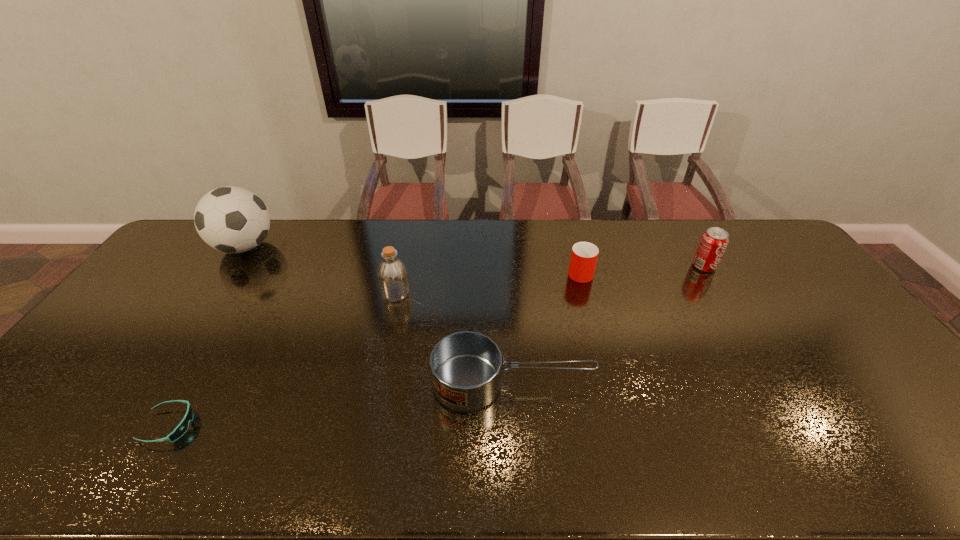
Image resolution: width=960 pixels, height=540 pixels. I want to click on vacant space located on the right of the rightmost object, so click(796, 266).

At what (x,y) coordinates should I click in order to perform the action: click on vacant region located 0.130m on the side of the fifth object from left to right with the handle. Please return your answer as a coordinate pair (x, y). Looking at the image, I should click on (571, 239).

Where is `free region located on the side of the fifth object from left to right with the handle`? The image size is (960, 540). free region located on the side of the fifth object from left to right with the handle is located at coordinates (567, 225).

What are the coordinates of `free space located 0.070m on the side of the fifth object from left to right with the handle` in the screenshot? It's located at (574, 248).

Where is `vacant area situated 0.330m with the handle extending from one side of the fourth object from left to right`? vacant area situated 0.330m with the handle extending from one side of the fourth object from left to right is located at coordinates (721, 383).

You are a GUI agent. You are given a task and a screenshot of the screen. Output one action in this format:
    pyautogui.click(x=<x>, y=<y>)
    Task: Click on the vacant space located 0.050m on the front-facing side of the sunglasses
    
    Given the screenshot: What is the action you would take?
    pyautogui.click(x=214, y=426)

Where is `soccer ball situated at the far edge`? The height and width of the screenshot is (540, 960). soccer ball situated at the far edge is located at coordinates (231, 219).

The height and width of the screenshot is (540, 960). Identify the location of soda that is at the far edge. (713, 243).

Locate an element on the screen. Image resolution: width=960 pixels, height=540 pixels. object present at the near edge is located at coordinates (181, 429).

At what (x,y) coordinates should I click in order to perform the action: click on object that is at the left edge. Please return your answer as a coordinate pair (x, y). The image size is (960, 540). Looking at the image, I should click on (231, 219).